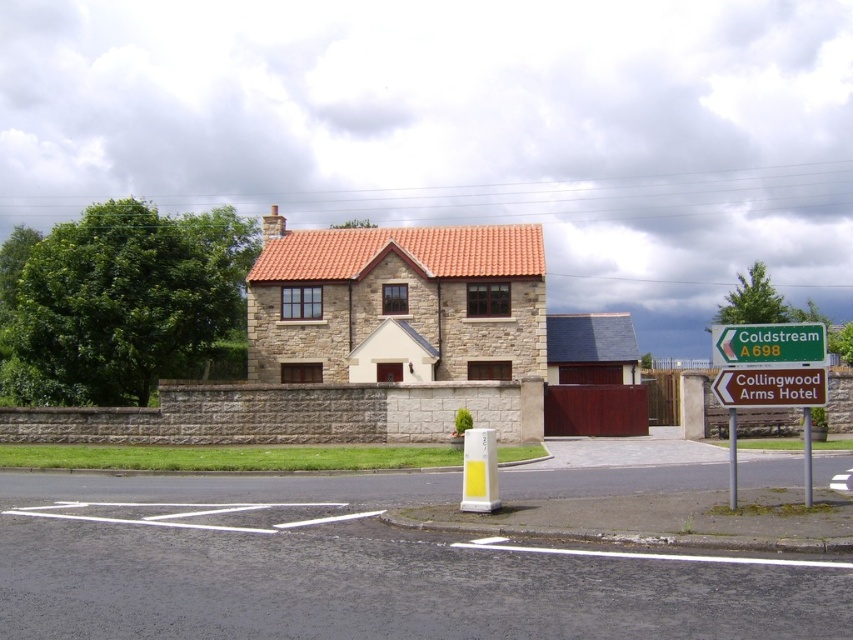
Question: Which of the following is the closest to the observer?

Choices:
 (A) (714, 346)
 (B) (766, 381)

Answer: (B)

Question: Among these objects, which one is farthest from the camera?

Choices:
 (A) greenmaterial/texturesign at upper right
 (B) green plastic sign at upper right

Answer: (A)

Question: In this image, where is green plastic sign at upper right located relative to greenmaterial/texturesign at upper right?

Choices:
 (A) below
 (B) above

Answer: (B)

Question: Is green plastic sign at upper right below greenmaterial/texturesign at upper right?

Choices:
 (A) yes
 (B) no

Answer: (B)

Question: Is green plastic sign at upper right to the left of greenmaterial/texturesign at upper right from the viewer's perspective?

Choices:
 (A) yes
 (B) no

Answer: (B)